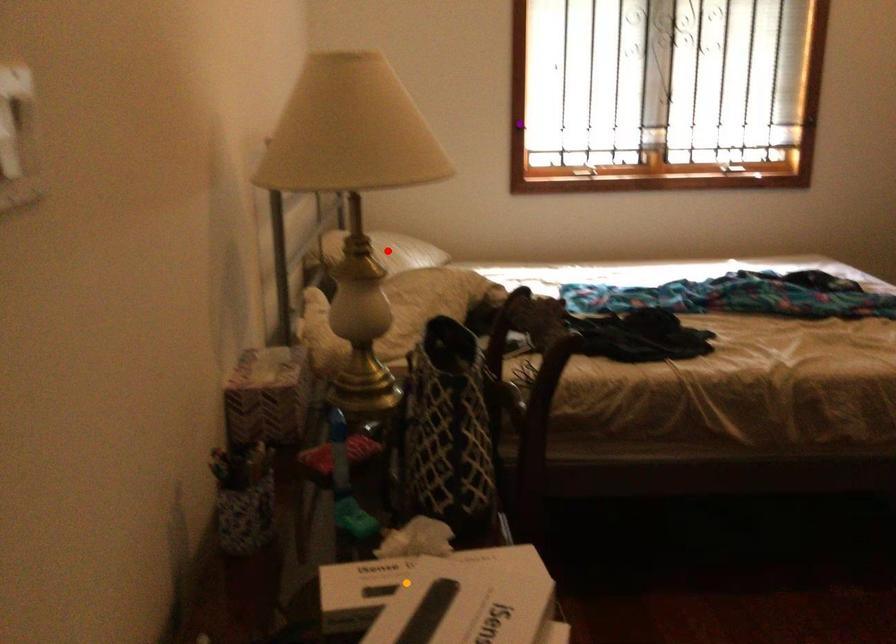
Order these from nearest to farthest:
- purple point
- red point
- orange point

orange point < red point < purple point